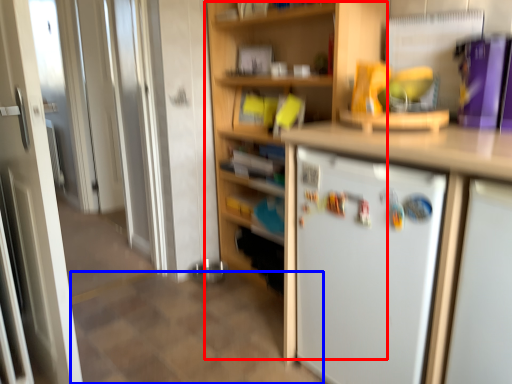
Question: Which of the following is the closest to the observer, bookshelf (highlighted by a red box) or tile (highlighted by a blue box)?

Choices:
 (A) bookshelf
 (B) tile

Answer: (B)